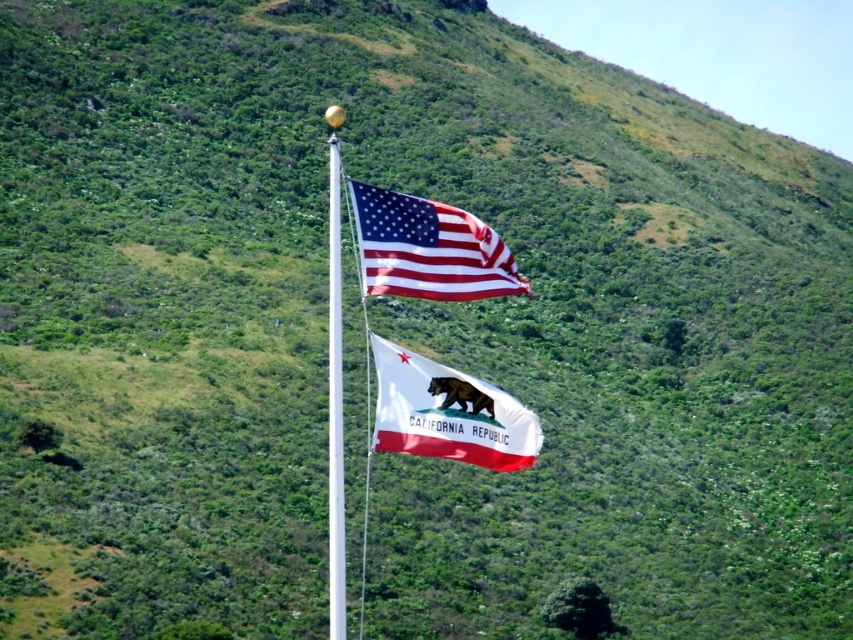
Does white fabric flag at center have a lesser width compared to matte fabric flag at upper center?

Indeed, white fabric flag at center has a lesser width compared to matte fabric flag at upper center.

Does point (403, 406) come in front of point (486, 288)?

Yes.

Is point (399, 392) positioned in front of point (363, 256)?

Yes, it is in front of point (363, 256).

Locate an element on the screen. The width and height of the screenshot is (853, 640). white fabric flag at center is located at coordinates (448, 413).

Looking at this image, does white fabric flag at center appear under white glossy flag pole at center?

Indeed, white fabric flag at center is positioned under white glossy flag pole at center.

Image resolution: width=853 pixels, height=640 pixels. Identify the location of white fabric flag at center. (448, 413).

You are a GUI agent. You are given a task and a screenshot of the screen. Output one action in this format:
    pyautogui.click(x=<x>, y=<y>)
    Task: Click on the white fabric flag at center
    This screenshot has height=640, width=853.
    Given the screenshot: What is the action you would take?
    pyautogui.click(x=448, y=413)

Is matte fabric flag at upper center bigger than white glossy flag pole at center?

No.

From the picture: Can you confirm if matte fabric flag at upper center is taller than white glossy flag pole at center?

Incorrect, matte fabric flag at upper center's height is not larger of white glossy flag pole at center's.

Who is more distant from viewer, (x=389, y=228) or (x=339, y=292)?

The point (x=339, y=292) is behind.

Locate an element on the screen. The width and height of the screenshot is (853, 640). matte fabric flag at upper center is located at coordinates (428, 248).